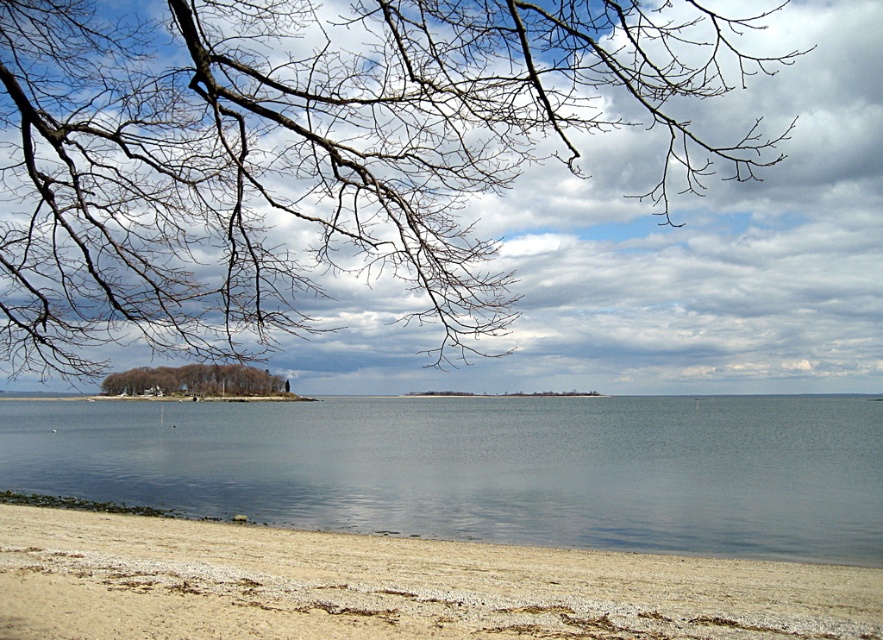
Looking at this image, you are an artist planning to sketch this coastal scene. You want to ensure the bare branches at upper left and the brown textured island at lower left are proportionally accurate. Based on the scene, which object should you draw smaller in your sketch?

The bare branches at upper left should be drawn smaller because they occupy less space than the brown textured island at lower left in the scene.

You are a beachcomber searching for hidden treasures on the beach. You notice the clear water at lower center and the light brown sand at lower left. Which surface would you choose to look for items that might be buried or resting there, and why?

You should look in the light brown sand at lower left because the clear water at lower center is positioned over it, meaning items could have settled into the sand beneath the water.